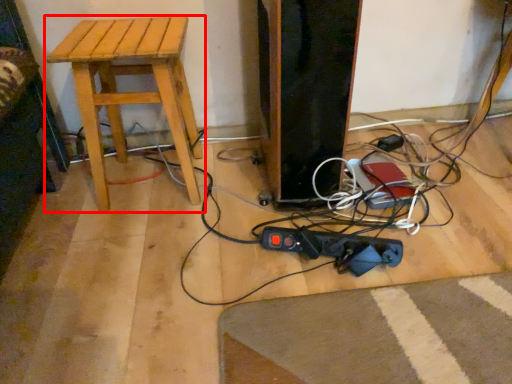
Question: In this image, where is stool (annotated by the red box) located relative to plug?

Choices:
 (A) right
 (B) left

Answer: (B)